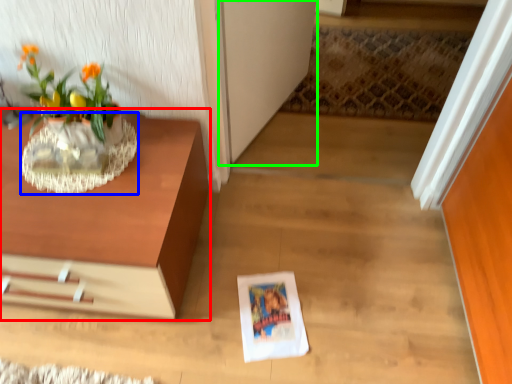
Question: Which object is positioned closest to table (highlighted by a red box)? Select from vase (highlighted by a blue box) and glass door (highlighted by a green box).

Choices:
 (A) vase
 (B) glass door

Answer: (A)